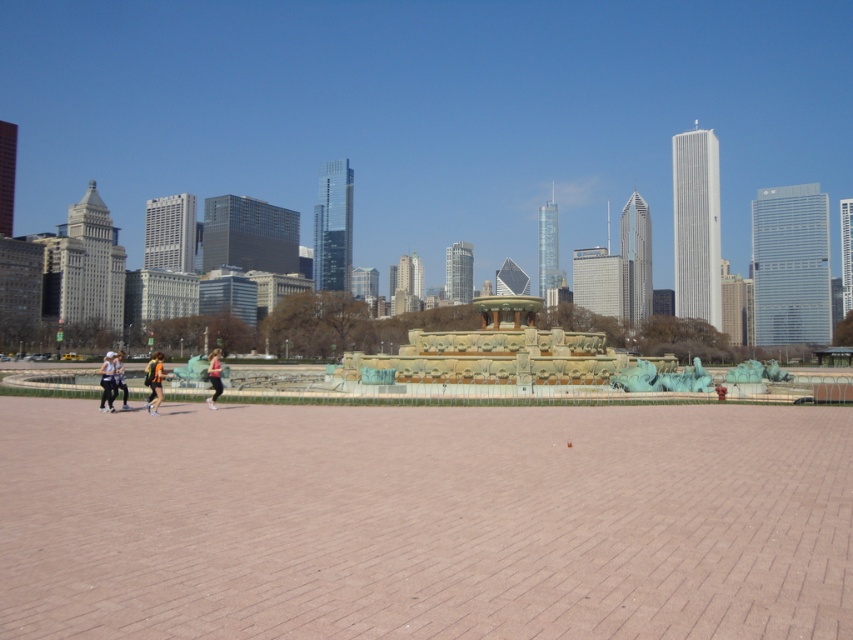
Question: Observing the image, what is the correct spatial positioning of orange athletic wear at center in reference to matte black jacket at lower left?

Choices:
 (A) right
 (B) left

Answer: (A)

Question: Can you confirm if matte black jacket at lower left is bigger than matte pink leggings at center?

Choices:
 (A) yes
 (B) no

Answer: (A)

Question: Which of the following is the closest to the observer?

Choices:
 (A) orange athletic wear at center
 (B) matte pink leggings at center
 (C) matte black jacket at lower left

Answer: (A)

Question: Which of the following is the closest to the observer?

Choices:
 (A) orange athletic wear at center
 (B) matte pink leggings at center
 (C) matte black jacket at lower left

Answer: (A)

Question: Which point is farther from the camera taking this photo?

Choices:
 (A) (154, 385)
 (B) (106, 403)
 (C) (219, 385)

Answer: (C)

Question: Is orange athletic wear at center closer to camera compared to matte black jacket at lower left?

Choices:
 (A) no
 (B) yes

Answer: (B)